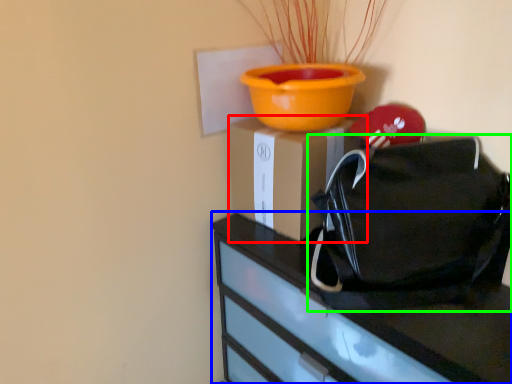
Question: Based on their relative distances, which object is nearer to cardboard box (highlighted by a red box)? Choose from furniture (highlighted by a blue box) and handbag (highlighted by a green box).

Choices:
 (A) furniture
 (B) handbag

Answer: (B)